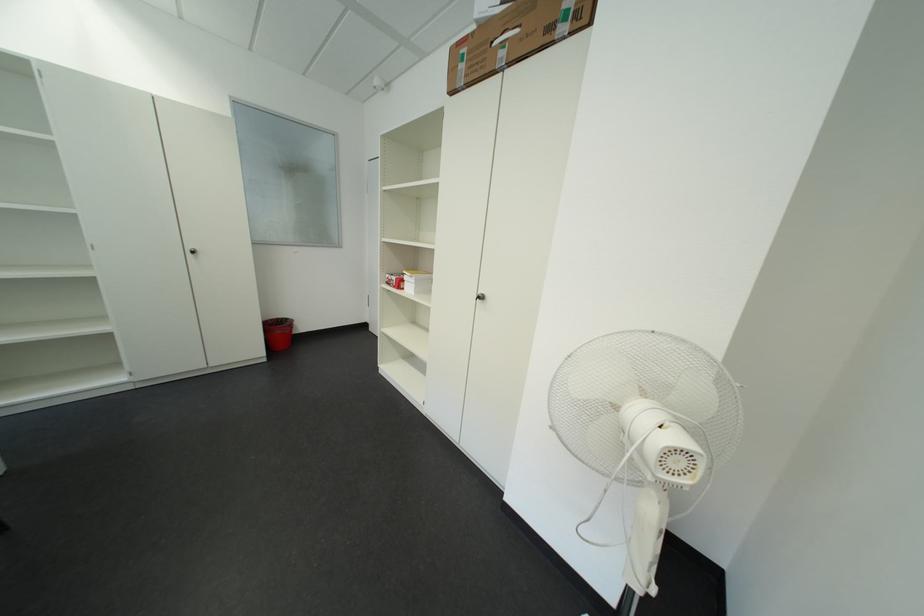
Locate an element on the screen. The height and width of the screenshot is (616, 924). cardboard box handle is located at coordinates (505, 36).